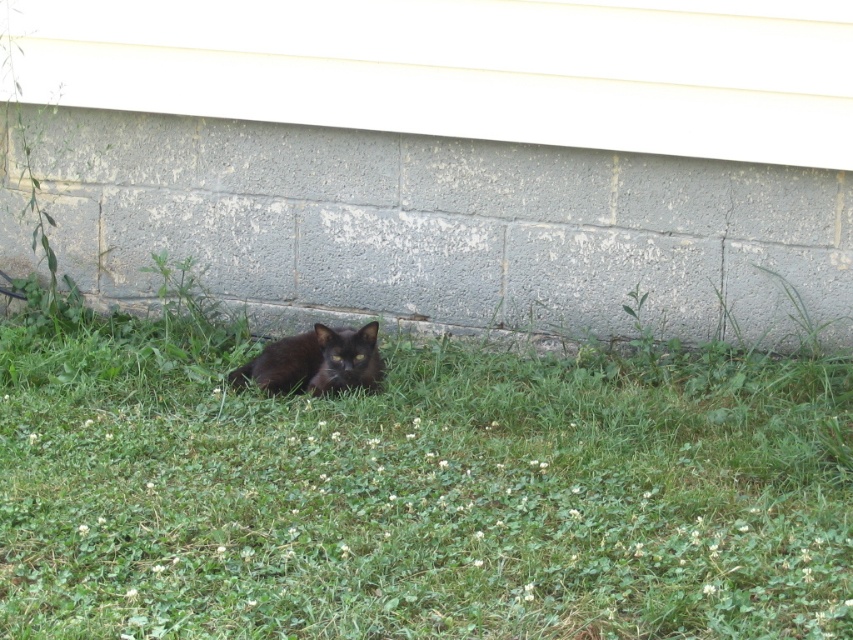
You are standing in the scene and want to take a photo of both point (131, 568) and point (316, 362). Which point should you focus on first to ensure both are in sharp focus?

You should focus on point (131, 568) first because it is closer to the camera than point (316, 362), ensuring both will be in focus when using depth of field appropriately.

Consider the image. You are a photographer trying to capture the shiny black cat at lower center on the green grass at lower center. Since the cat is lying on the grass, will the cat block the grass from being visible in the photo?

The green grass at lower center is positioned under the shiny black cat at lower center, so the cat will block the grass from being visible in the photo.

You are a photographer trying to capture the shiny black cat at lower center. You notice the green grass at lower center is in the foreground. Will the grass block your view of the cat?

The green grass at lower center is larger in size than the shiny black cat at lower center, so it might block the view of the cat depending on their positions.